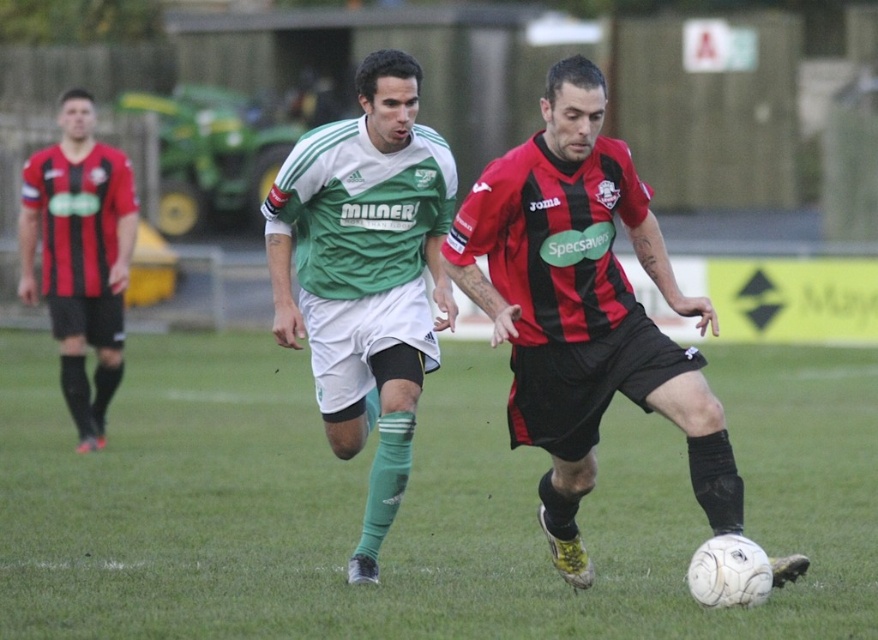
Does green grass at center appear over red/black striped jersey at left?

Incorrect, green grass at center is not positioned above red/black striped jersey at left.

Is green grass at center positioned at the back of red/black striped jersey at left?

No.

Identify the location of green grass at center. (414, 502).

Does green matte jersey at center have a smaller size compared to red/black striped jersey at left?

No.

Between point (347, 433) and point (91, 445), which one is positioned in front?

Point (347, 433) is more forward.

Does point (402, 272) lie in front of point (106, 232)?

Yes, point (402, 272) is closer to viewer.

The width and height of the screenshot is (878, 640). Identify the location of green matte jersey at center. (365, 275).

Is green grass at center positioned behind red-black striped jersey at center?

No, green grass at center is in front of red-black striped jersey at center.

Is green grass at center bigger than red-black striped jersey at center?

Yes.

Between point (732, 387) and point (556, 513), which one is positioned in front?

Point (556, 513) is more forward.

Find the location of `green grass at center`. green grass at center is located at coordinates (414, 502).